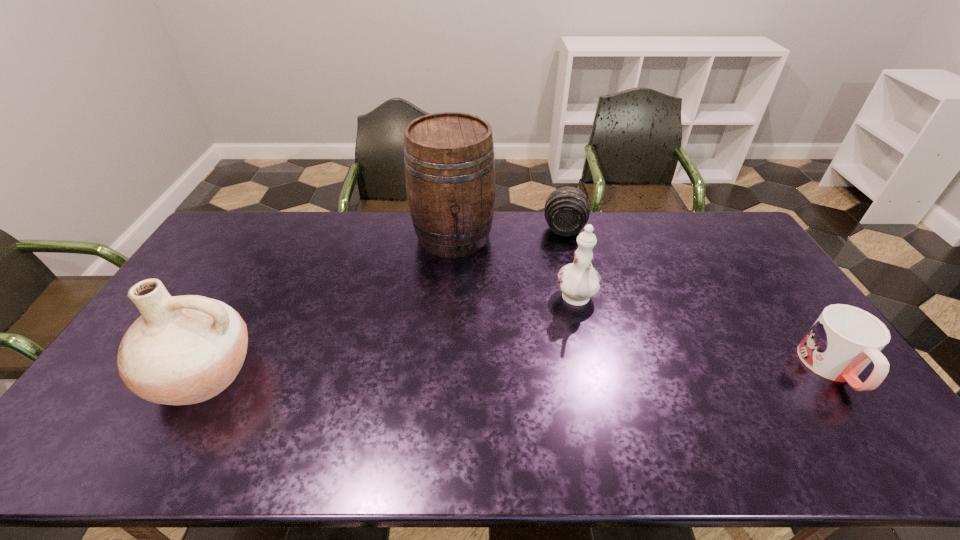
The height and width of the screenshot is (540, 960). I want to click on object situated at the left edge, so coord(182,350).

Where is `object positioned at the right edge`? This screenshot has width=960, height=540. object positioned at the right edge is located at coordinates (844, 339).

Where is `object positioned at the near left corner`? This screenshot has width=960, height=540. object positioned at the near left corner is located at coordinates (182, 350).

I want to click on object that is at the near right corner, so click(844, 339).

Where is `free space at the far edge of the desktop`? free space at the far edge of the desktop is located at coordinates (313, 241).

At what (x,y) coordinates should I click in order to perform the action: click on vacant space at the near edge of the desktop. Please return your answer as a coordinate pair (x, y). The image size is (960, 540). Looking at the image, I should click on (726, 401).

In the image, there is a desktop. In order to click on vacant space at the left edge in this screenshot , I will do `click(213, 261)`.

The image size is (960, 540). I want to click on free region at the right edge of the desktop, so click(x=733, y=271).

Identify the location of free space at the near right corner of the desktop. (803, 397).

The image size is (960, 540). Find the location of `free space that is in between the fourth object from right to left and the rightmost object`. free space that is in between the fourth object from right to left and the rightmost object is located at coordinates (643, 302).